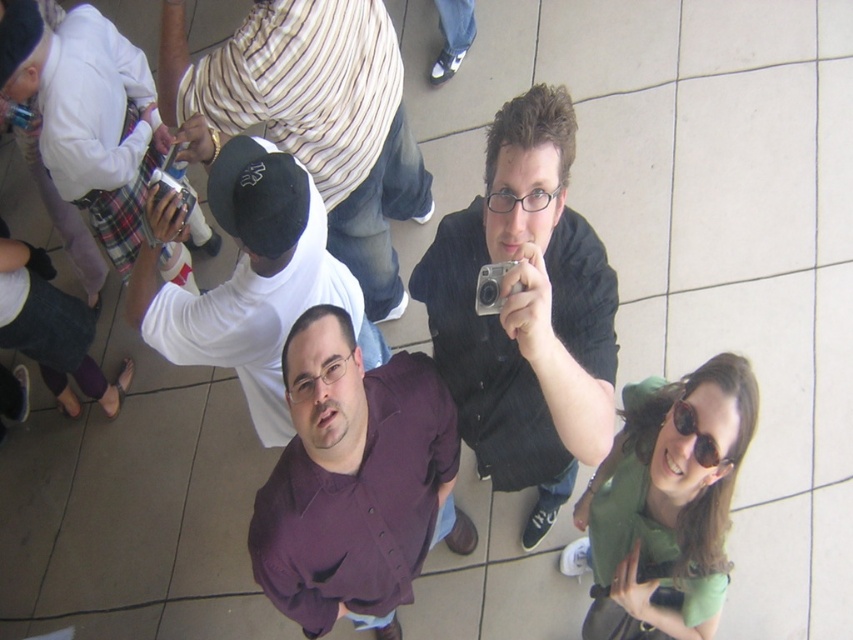
You are a photographer setting up a camera on a tripod. You need to ensure that both the white matte cap at upper left and the green fabric shirt at center are in the frame. Given that the camera has a fixed focal length, which object should you prioritize positioning closer to the camera to ensure both fit within the frame?

The white matte cap at upper left should be positioned closer to the camera because its width surpasses that of the green fabric shirt at center, making it larger and potentially requiring more space in the frame.

You are a photographer taking a picture of the scene from above. You notice the white matte cap at upper left and the sunglasses at upper center. Which object is directly above the other?

The white matte cap at upper left is positioned over the sunglasses at upper center.